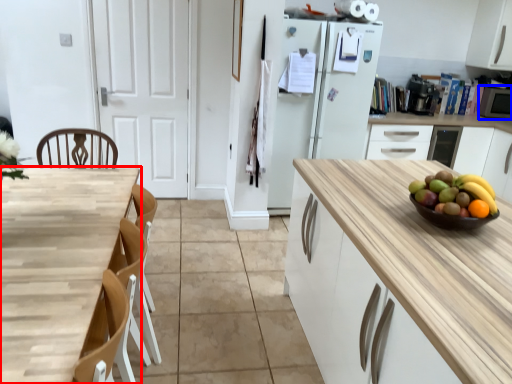
Question: Which object appears farthest to the camera in this image, countertop (highlighted by a red box) or appliance (highlighted by a blue box)?

Choices:
 (A) countertop
 (B) appliance

Answer: (B)